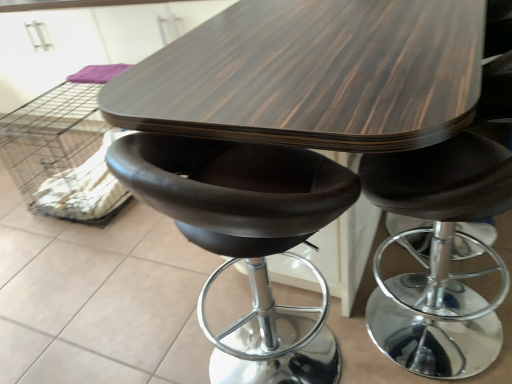
Image resolution: width=512 pixels, height=384 pixels. What do you see at coordinates (247, 239) in the screenshot?
I see `matte black stool at center` at bounding box center [247, 239].

What do you see at coordinates (313, 76) in the screenshot? I see `dark wood table at center` at bounding box center [313, 76].

What do you see at coordinates (51, 136) in the screenshot? I see `white fabric crate at lower left` at bounding box center [51, 136].

Find the location of a particular element. The image size is (512, 384). matte black stool at center is located at coordinates (247, 239).

Is matte black stool at center spatially inside white fabric crate at lower left, or outside of it?

matte black stool at center is outside white fabric crate at lower left.

Is point (279, 224) behind point (22, 109)?

No, (279, 224) is in front of (22, 109).

From a real-world perspective, is matte black stool at center on top of white fabric crate at lower left?

Correct, in the physical world, matte black stool at center is higher than white fabric crate at lower left.

In terms of width, does matte black stool at center look wider or thinner when compared to white fabric crate at lower left?

In the image, matte black stool at center appears to be more narrow than white fabric crate at lower left.

Looking at this image, who is shorter, dark wood table at center or matte black stool at center?

dark wood table at center is shorter.

Between dark wood table at center and matte black stool at center, which one has larger width?

Wider between the two is dark wood table at center.

From a real-world perspective, who is located higher, dark wood table at center or matte black stool at center?

matte black stool at center.

How many degrees apart are the facing directions of dark wood table at center and matte black stool at center?

They differ by 93.6 degrees in their facing directions.

At what (x,y) coordinates should I click in order to perform the action: click on table directly beneath the matte black stool at center (from a real-world perspective). Please return your answer as a coordinate pair (x, y). Looking at the image, I should click on (313, 76).

Is matte black stool at center wider than dark wood table at center?

In fact, matte black stool at center might be narrower than dark wood table at center.

From their relative heights in the image, would you say matte black stool at center is taller or shorter than dark wood table at center?

Considering their sizes, matte black stool at center has more height than dark wood table at center.

From a real-world perspective, relative to dark wood table at center, is matte black stool at center vertically above or below?

matte black stool at center is situated higher than dark wood table at center in the real world.

Which point is more distant from viewer, [362,39] or [0,118]?

Point [0,118]

Which is in front, dark wood table at center or white fabric crate at lower left?

dark wood table at center is closer to the camera.

Is dark wood table at center inside the boundaries of white fabric crate at lower left, or outside?

dark wood table at center is not inside white fabric crate at lower left, it's outside.

Considering the relative sizes of white fabric crate at lower left and dark wood table at center in the image provided, is white fabric crate at lower left taller than dark wood table at center?

No, white fabric crate at lower left is not taller than dark wood table at center.

From the image's perspective, would you say white fabric crate at lower left is shown under dark wood table at center?

Actually, white fabric crate at lower left appears above dark wood table at center in the image.

In the image, is white fabric crate at lower left positioned in front of or behind dark wood table at center?

Visually, white fabric crate at lower left is located behind dark wood table at center.

Considering the points (94, 90) and (405, 36), which point is in front, point (94, 90) or point (405, 36)?

The point (405, 36) is more forward.

Which object is positioned more to the left, white fabric crate at lower left or matte black stool at center?

Positioned to the left is white fabric crate at lower left.

The height and width of the screenshot is (384, 512). There is a white fabric crate at lower left. Find the location of `chair above it (from a real-world perspective)`. chair above it (from a real-world perspective) is located at coordinates (247, 239).

Which point is more forward, (85, 91) or (217, 357)?

The point (217, 357) is more forward.

Is white fabric crate at lower left directly adjacent to matte black stool at center?

No, white fabric crate at lower left is not making contact with matte black stool at center.

This screenshot has height=384, width=512. In the image, there is a matte black stool at center. What are the coordinates of `crate above it (from the image's perspective)` in the screenshot? It's located at (51, 136).

In order to click on chair that appears above the dark wood table at center (from a real-world perspective) in this screenshot , I will do `click(247, 239)`.

From the image, which object appears to be nearer to dark wood table at center, matte black stool at center or white fabric crate at lower left?

matte black stool at center.

Which object lies nearer to the anchor point matte black stool at center, white fabric crate at lower left or dark wood table at center?

Based on the image, dark wood table at center appears to be nearer to matte black stool at center.

Based on their spatial positions, is dark wood table at center or matte black stool at center further from white fabric crate at lower left?

Based on the image, matte black stool at center appears to be further to white fabric crate at lower left.

Estimate the real-world distances between objects in this image. Which object is closer to dark wood table at center, white fabric crate at lower left or matte black stool at center?

matte black stool at center.

Looking at the image, which one is located further to white fabric crate at lower left, matte black stool at center or dark wood table at center?

matte black stool at center lies further to white fabric crate at lower left than the other object.

Estimate the real-world distances between objects in this image. Which object is further from matte black stool at center, dark wood table at center or white fabric crate at lower left?

white fabric crate at lower left lies further to matte black stool at center than the other object.

Locate an element on the screen. The image size is (512, 384). table located between matte black stool at center and white fabric crate at lower left in the depth direction is located at coordinates (313, 76).